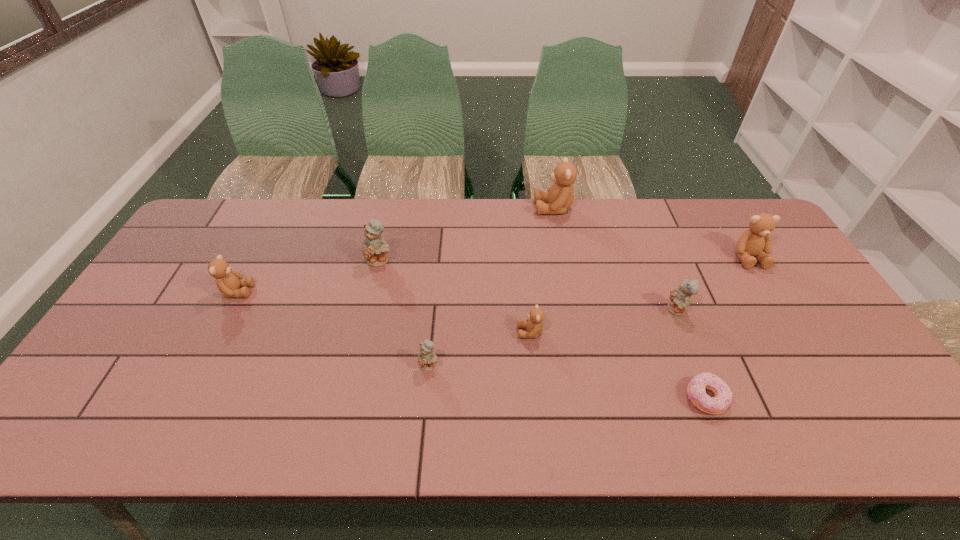
Identify the location of object that is at the far edge. (560, 196).

This screenshot has width=960, height=540. What are the coordinates of `object positioned at the near edge` in the screenshot? It's located at (696, 392).

Where is `object that is at the right edge`? The width and height of the screenshot is (960, 540). object that is at the right edge is located at coordinates (756, 242).

Identify the location of vacant space at the far edge. The width and height of the screenshot is (960, 540). (600, 242).

Find the location of `free space at the near edge`. free space at the near edge is located at coordinates (617, 411).

At what (x,y) coordinates should I click in order to perform the action: click on vacant space at the left edge of the desktop. Please return your answer as a coordinate pair (x, y). This screenshot has height=540, width=960. Looking at the image, I should click on (119, 353).

Where is `vacant region at the right edge of the desktop`? The width and height of the screenshot is (960, 540). vacant region at the right edge of the desktop is located at coordinates (811, 306).

I want to click on free point at the near left corner, so click(85, 442).

Find the location of a particular element. The width and height of the screenshot is (960, 540). free space at the far right corner of the desktop is located at coordinates (726, 240).

Where is `vacant point located between the leftmost object and the third nearest brown teddy bear`? The width and height of the screenshot is (960, 540). vacant point located between the leftmost object and the third nearest brown teddy bear is located at coordinates (492, 274).